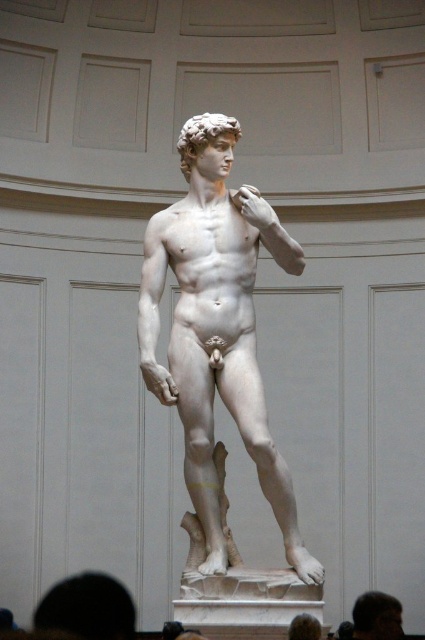
Who is more forward, (240, 362) or (393, 637)?

Point (240, 362) is in front.

Where is `white marble statue at center`? This screenshot has height=640, width=425. white marble statue at center is located at coordinates (217, 328).